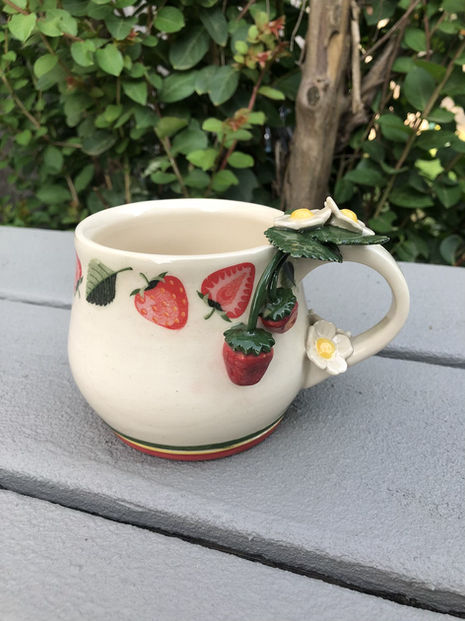
This screenshot has width=465, height=621. I want to click on pot, so click(x=283, y=325).